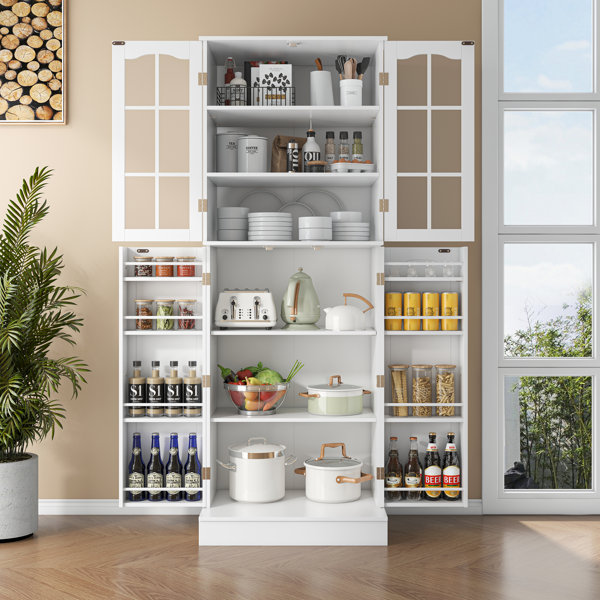
The width and height of the screenshot is (600, 600). In order to click on bowls in this screenshot , I will do `click(230, 233)`, `click(229, 223)`, `click(230, 210)`, `click(315, 234)`, `click(316, 218)`, `click(342, 216)`.